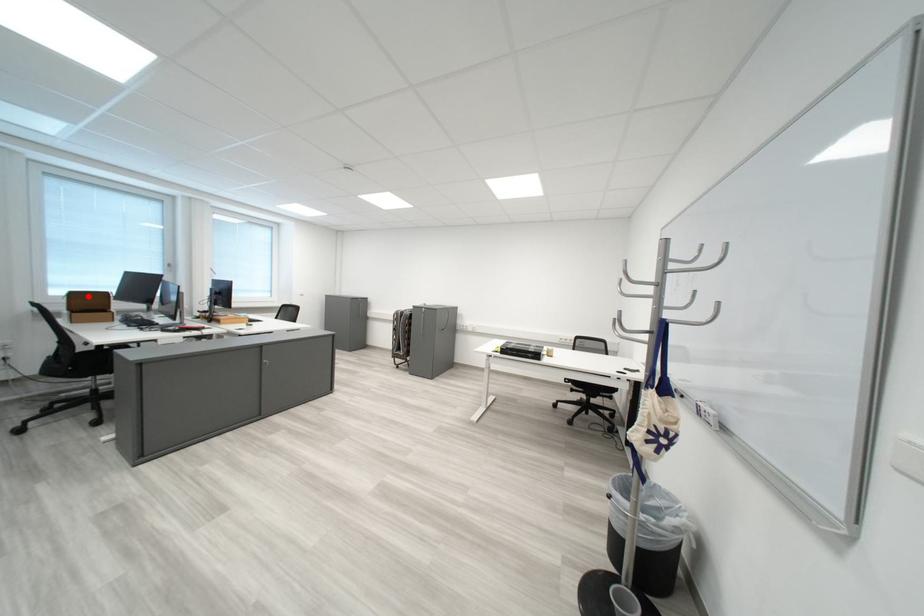
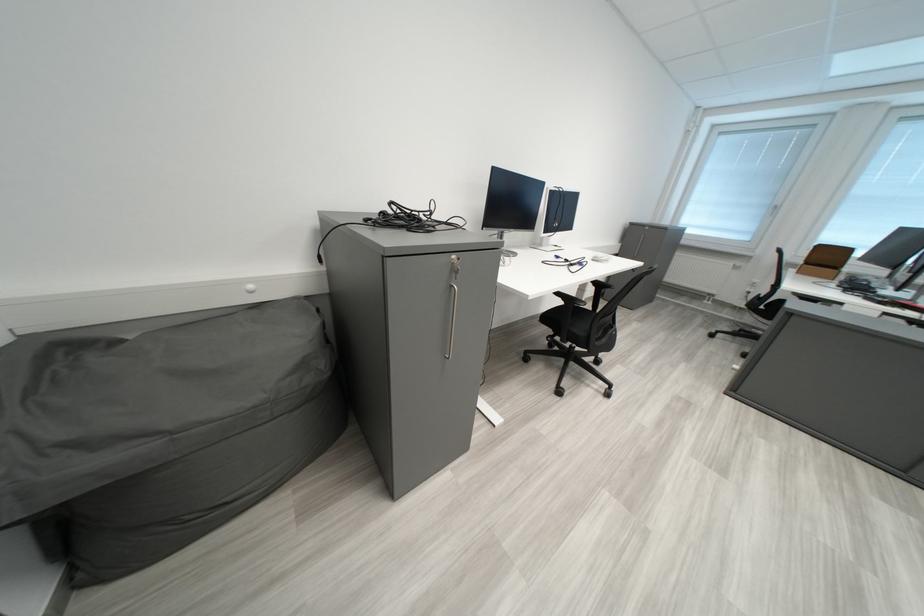
Where in the second image is the point corresponding to the highlighted location from the first image?

(833, 249)